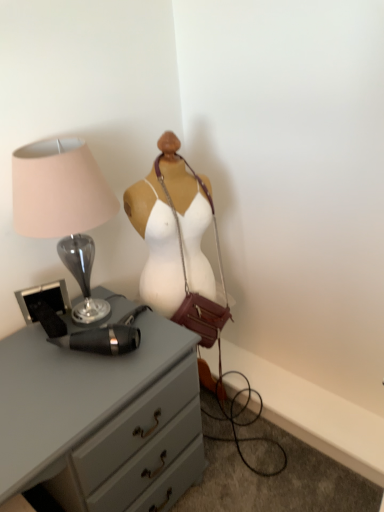
Locate an element on the screen. This screenshot has width=384, height=512. blank space above matte gray chest of drawers at center-left (from a real-world perspective) is located at coordinates (63, 361).